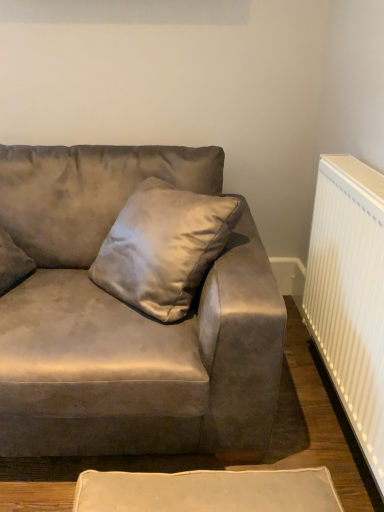
This screenshot has width=384, height=512. What do you see at coordinates (128, 318) in the screenshot?
I see `suede gray couch at center` at bounding box center [128, 318].

This screenshot has height=512, width=384. In order to click on white ribbed radiator at right in this screenshot , I will do `click(350, 294)`.

Considering the relative sizes of white ribbed radiator at right and suede gray couch at center in the image provided, is white ribbed radiator at right thinner than suede gray couch at center?

Indeed, white ribbed radiator at right has a lesser width compared to suede gray couch at center.

Is white ribbed radiator at right inside the boundaries of suede gray couch at center, or outside?

white ribbed radiator at right is spatially situated outside suede gray couch at center.

Is point (350, 324) closer or farther from the camera than point (9, 327)?

Point (350, 324) is closer to the camera than point (9, 327).

Which object is closer to the camera taking this photo, white ribbed radiator at right or suede gray couch at center?

suede gray couch at center is in front.

Is suede gray couch at center oriented away from white ribbed radiator at right?

No, suede gray couch at center is not facing the opposite direction of white ribbed radiator at right.

Which is behind, point (76, 246) or point (374, 195)?

Positioned behind is point (76, 246).

From the image's perspective, who appears lower, suede gray couch at center or white ribbed radiator at right?

white ribbed radiator at right appears lower in the image.

Which object is positioned more to the left, suede gray couch at center or white ribbed radiator at right?

From the viewer's perspective, suede gray couch at center appears more on the left side.

Are satin gray pillow at center and white ribbed radiator at right making contact?

There is a gap between satin gray pillow at center and white ribbed radiator at right.

In the scene shown: What's the angular difference between satin gray pillow at center and white ribbed radiator at right's facing directions?

The angular difference between satin gray pillow at center and white ribbed radiator at right is 43 degrees.

Between satin gray pillow at center and white ribbed radiator at right, which one has smaller size?

white ribbed radiator at right is smaller.

From the image's perspective, is satin gray pillow at center on top of white ribbed radiator at right?

Yes, from the image's perspective, satin gray pillow at center is over white ribbed radiator at right.

From a real-world perspective, is suede gray couch at center located beneath satin gray pillow at center?

Yes, from a real-world perspective, suede gray couch at center is under satin gray pillow at center.

This screenshot has width=384, height=512. What are the coordinates of `studio couch on the left of satin gray pillow at center` in the screenshot? It's located at (128, 318).

Between suede gray couch at center and satin gray pillow at center, which one has less height?

satin gray pillow at center is shorter.

From a real-world perspective, is white ribbed radiator at right below satin gray pillow at center?

Yes, from a real-world perspective, white ribbed radiator at right is below satin gray pillow at center.

Considering the relative positions of white ribbed radiator at right and satin gray pillow at center in the image provided, is white ribbed radiator at right to the right of satin gray pillow at center from the viewer's perspective?

Indeed, white ribbed radiator at right is positioned on the right side of satin gray pillow at center.

Would you consider white ribbed radiator at right to be distant from satin gray pillow at center?

No, white ribbed radiator at right is in close proximity to satin gray pillow at center.

From the image's perspective, who appears lower, satin gray pillow at center or suede gray couch at center?

suede gray couch at center, from the image's perspective.

Does satin gray pillow at center come in front of suede gray couch at center?

No, satin gray pillow at center is further to the viewer.

Is point (224, 224) closer or farther from the camera than point (138, 325)?

Point (224, 224).

Who is shorter, satin gray pillow at center or suede gray couch at center?

With less height is satin gray pillow at center.

Where is `studio couch that appears above the white ribbed radiator at right (from the image's perspective)`? studio couch that appears above the white ribbed radiator at right (from the image's perspective) is located at coordinates (128, 318).

In order to click on studio couch located in front of the white ribbed radiator at right in this screenshot , I will do `click(128, 318)`.

From the image, which object appears to be farther from satin gray pillow at center, white ribbed radiator at right or suede gray couch at center?

white ribbed radiator at right.

Based on their spatial positions, is white ribbed radiator at right or satin gray pillow at center closer to suede gray couch at center?

The object closer to suede gray couch at center is satin gray pillow at center.

When comparing their distances from satin gray pillow at center, does suede gray couch at center or white ribbed radiator at right seem closer?

Among the two, suede gray couch at center is located nearer to satin gray pillow at center.

Looking at this image, considering their positions, is satin gray pillow at center positioned further to white ribbed radiator at right than suede gray couch at center?

satin gray pillow at center is positioned further to the anchor white ribbed radiator at right.

Estimate the real-world distances between objects in this image. Which object is closer to white ribbed radiator at right, suede gray couch at center or satin gray pillow at center?

Among the two, suede gray couch at center is located nearer to white ribbed radiator at right.

Considering their positions, is satin gray pillow at center positioned closer to suede gray couch at center than white ribbed radiator at right?

satin gray pillow at center lies closer to suede gray couch at center than the other object.

Find the location of a particular element. The image size is (384, 512). pillow between suede gray couch at center and white ribbed radiator at right is located at coordinates (163, 247).